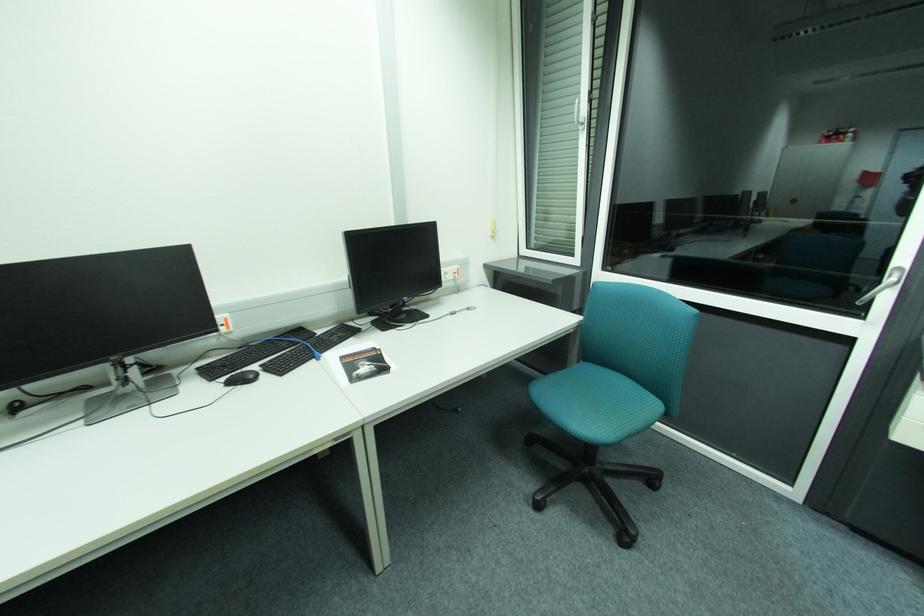
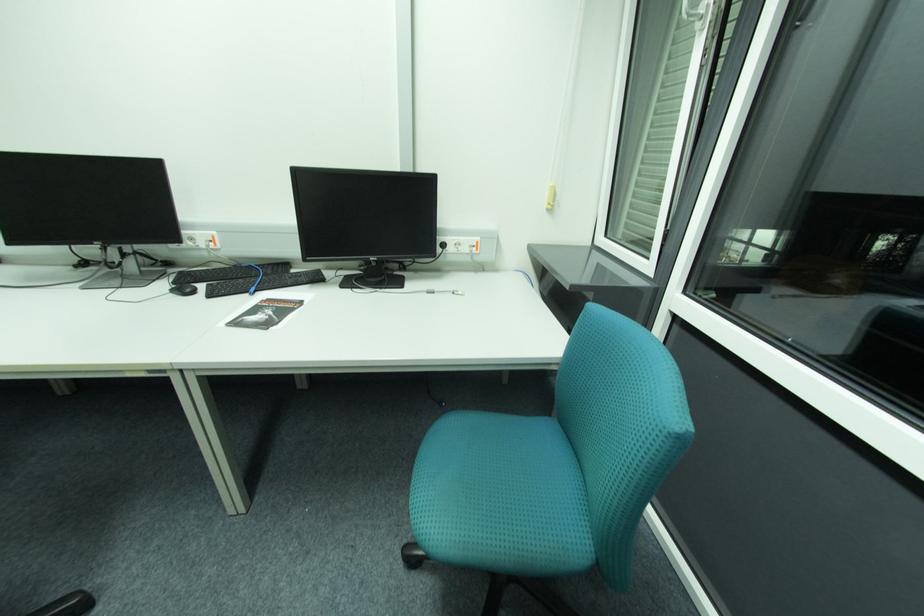
In the second image, find the point that corresponds to the point at 496,235 in the first image.

(552, 206)